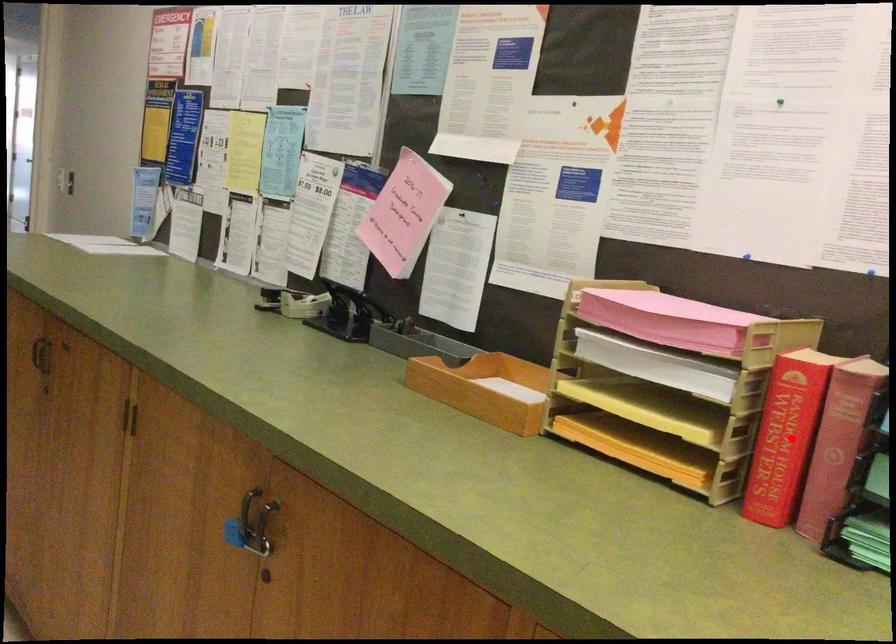
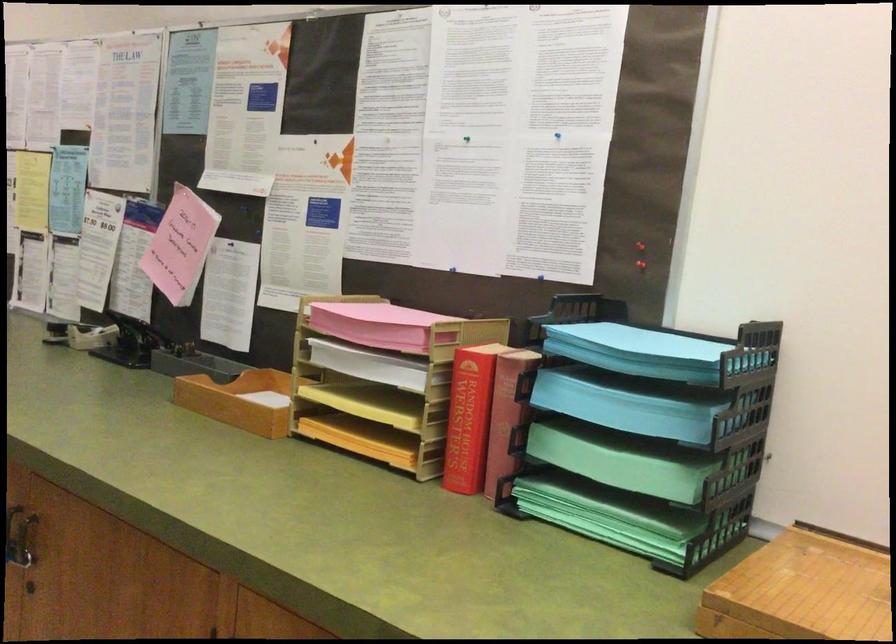
Find the pixel in the second image that matches the highlighted location in the first image.

(469, 418)